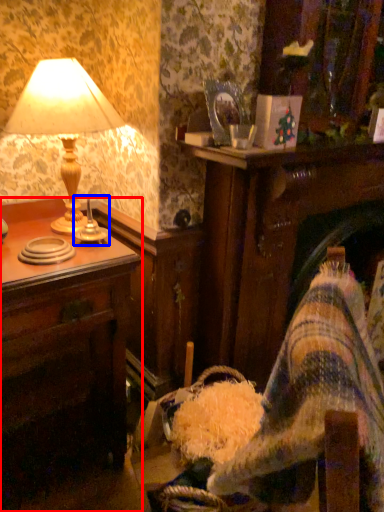
Question: Which object is closer to the camera taking this photo, desk (highlighted by a red box) or candle holder (highlighted by a blue box)?

Choices:
 (A) desk
 (B) candle holder

Answer: (A)